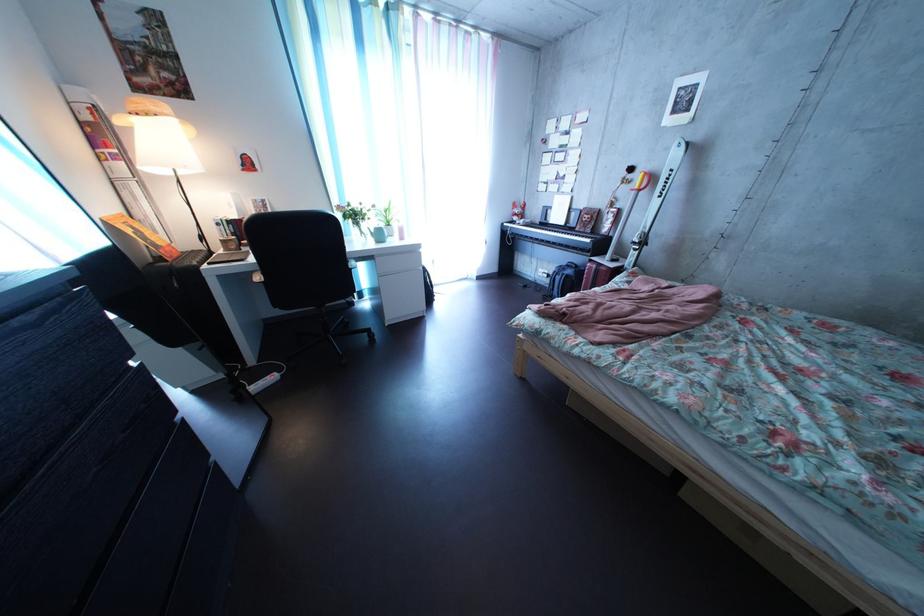
What do you see at coordinates (657, 248) in the screenshot?
I see `the ski pole handle` at bounding box center [657, 248].